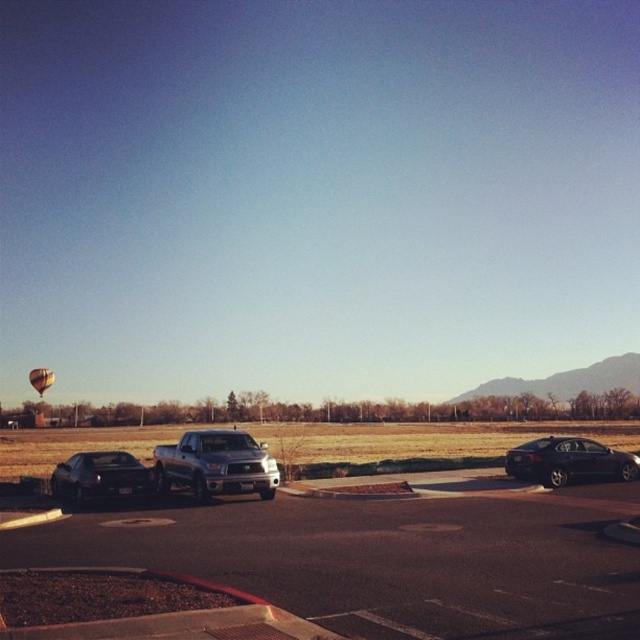
Question: Which of the following is the closest to the observer?

Choices:
 (A) shiny black sedan at left
 (B) smooth asphalt parking lot at center

Answer: (B)

Question: Can you confirm if black matte sedan at right is positioned to the left of shiny black sedan at left?

Choices:
 (A) yes
 (B) no

Answer: (B)

Question: Which of these objects is positioned closest to the smooth asphalt parking lot at center?

Choices:
 (A) yellow fabric balloon at lower left
 (B) black matte sedan at right
 (C) shiny black sedan at left

Answer: (C)

Question: Does black matte sedan at right appear over yellow fabric balloon at lower left?

Choices:
 (A) no
 (B) yes

Answer: (B)

Question: In this image, where is smooth asphalt parking lot at center located relative to shiny black sedan at left?

Choices:
 (A) right
 (B) left

Answer: (A)

Question: Which of the following is the closest to the observer?

Choices:
 (A) (160, 458)
 (B) (522, 458)
 (C) (349, 624)

Answer: (C)